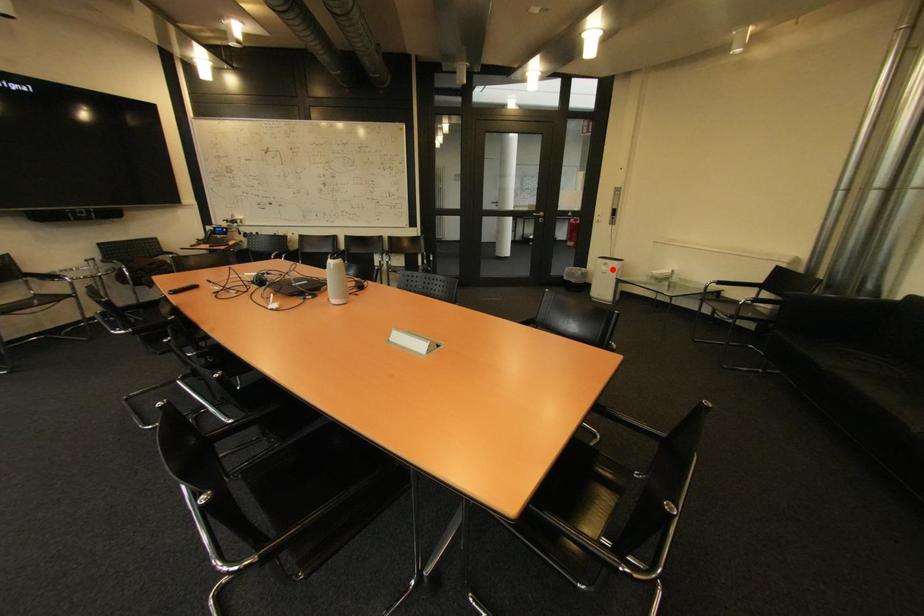
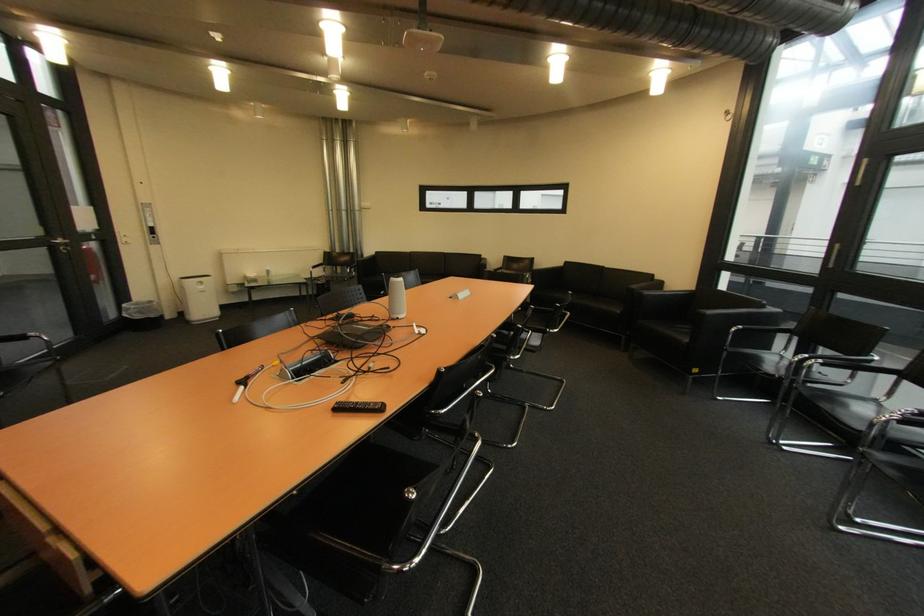
Find the pixel in the second image that matches the highlighted location in the first image.

(209, 288)